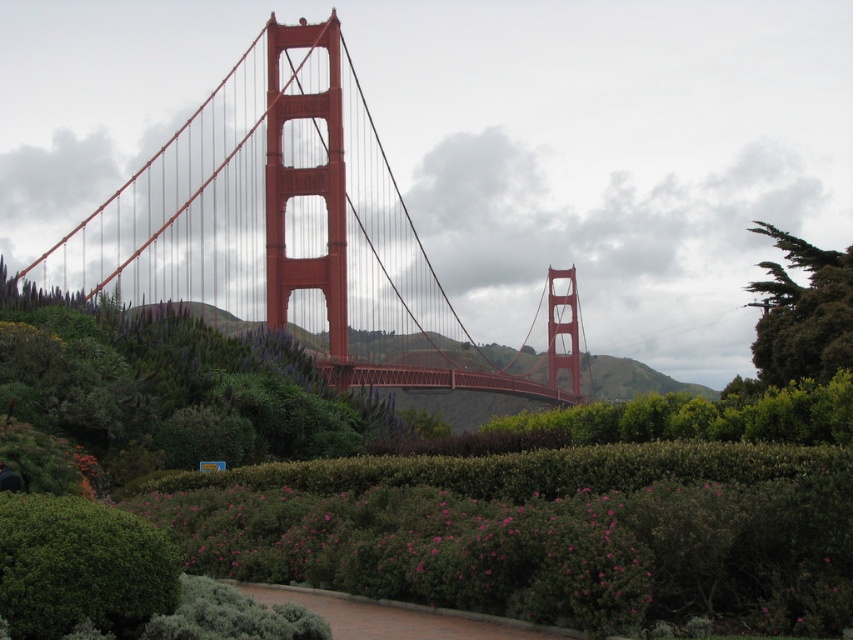
Does glossy steel suspension bridge at center have a smaller size compared to green leafy bush at lower left?

Actually, glossy steel suspension bridge at center might be larger than green leafy bush at lower left.

Can you confirm if glossy steel suspension bridge at center is positioned to the right of green leafy bush at lower left?

Yes, glossy steel suspension bridge at center is to the right of green leafy bush at lower left.

At what (x,y) coordinates should I click in order to perform the action: click on glossy steel suspension bridge at center. Please return your answer as a coordinate pair (x, y). Looking at the image, I should click on (296, 230).

Between point (294, 129) and point (810, 353), which one is positioned behind?

The point (294, 129) is more distant.

Is glossy steel suspension bridge at center below green textured tree at upper right?

No.

Where is `glossy steel suspension bridge at center`? This screenshot has width=853, height=640. glossy steel suspension bridge at center is located at coordinates (296, 230).

Looking at this image, does green leafy bush at lower left have a larger size compared to green textured tree at upper right?

Incorrect, green leafy bush at lower left is not larger than green textured tree at upper right.

Between green leafy bush at lower left and green textured tree at upper right, which one has more height?

green textured tree at upper right

Is point (86, 566) positioned before point (836, 356)?

Yes.

Locate an element on the screen. green leafy bush at lower left is located at coordinates (80, 566).